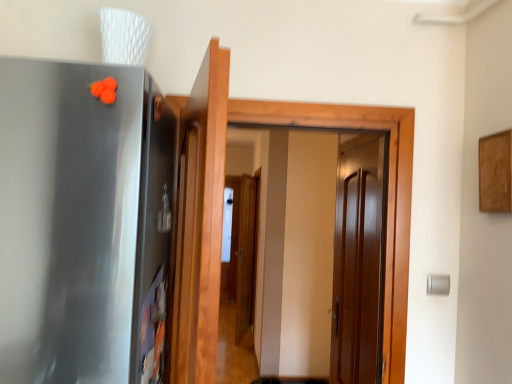
Describe the element at coordinates (357, 261) in the screenshot. The width and height of the screenshot is (512, 384). I see `glossy wood door at center, the first door when ordered from right to left` at that location.

Image resolution: width=512 pixels, height=384 pixels. Find the location of `wooden door at center, the first door from the front`. wooden door at center, the first door from the front is located at coordinates (200, 221).

What do you see at coordinates (83, 222) in the screenshot? I see `satin metallic refrigerator at left` at bounding box center [83, 222].

Image resolution: width=512 pixels, height=384 pixels. I want to click on glossy wood door at center, the first door when ordered from right to left, so click(357, 261).

Is wooden door at center, which ranks as the 2th door in back-to-front order, smaller than satin metallic refrigerator at left?

Yes, wooden door at center, which ranks as the 2th door in back-to-front order, is smaller than satin metallic refrigerator at left.

Identify the location of appliance above the wooden door at center, positioned as the 1th door in left-to-right order (from a real-world perspective). (83, 222).

Is wooden door at center, acting as the 2th door starting from the right, positioned beyond the bounds of satin metallic refrigerator at left?

Yes, wooden door at center, acting as the 2th door starting from the right, is outside of satin metallic refrigerator at left.

From a real-world perspective, is wooden door at center, acting as the 2th door starting from the right, physically located above or below satin metallic refrigerator at left?

Clearly, from a real-world perspective, wooden door at center, acting as the 2th door starting from the right, is below satin metallic refrigerator at left.

Are satin metallic refrigerator at left and wooden door at center, the first door from the front, beside each other?

satin metallic refrigerator at left is not next to wooden door at center, the first door from the front, and they're not touching.

From the picture: Between satin metallic refrigerator at left and wooden door at center, the first door from the front, which one has larger size?

satin metallic refrigerator at left.

There is a satin metallic refrigerator at left. Where is `the 1st door below it (from the image's perspective)`? Image resolution: width=512 pixels, height=384 pixels. the 1st door below it (from the image's perspective) is located at coordinates (200, 221).

Is satin metallic refrigerator at left a part of glossy wood door at center, the first door when ordered from right to left?

Actually, satin metallic refrigerator at left is outside glossy wood door at center, the first door when ordered from right to left.

Between glossy wood door at center, arranged as the first door when viewed from the back, and satin metallic refrigerator at left, which one has larger width?

Wider between the two is satin metallic refrigerator at left.

In terms of size, does glossy wood door at center, arranged as the first door when viewed from the back, appear bigger or smaller than satin metallic refrigerator at left?

glossy wood door at center, arranged as the first door when viewed from the back, is smaller than satin metallic refrigerator at left.

How different are the orientations of glossy wood door at center, arranged as the second door when viewed from the left, and satin metallic refrigerator at left in degrees?

86.9 degrees.

From a real-world perspective, is wooden door at center, the first door from the front, positioned over glossy wood door at center, the 2th door from the front, based on gravity?

Correct, in the physical world, wooden door at center, the first door from the front, is higher than glossy wood door at center, the 2th door from the front.

From the image's perspective, is wooden door at center, acting as the 2th door starting from the right, above or below glossy wood door at center, the 2th door from the front?

Clearly, from the image's perspective, wooden door at center, acting as the 2th door starting from the right, is above glossy wood door at center, the 2th door from the front.

Is wooden door at center, positioned as the 1th door in left-to-right order, oriented towards glossy wood door at center, arranged as the first door when viewed from the back?

No, wooden door at center, positioned as the 1th door in left-to-right order, is not oriented towards glossy wood door at center, arranged as the first door when viewed from the back.

Is wooden door at center, which ranks as the 2th door in back-to-front order, next to glossy wood door at center, arranged as the first door when viewed from the back?

No, wooden door at center, which ranks as the 2th door in back-to-front order, is not in contact with glossy wood door at center, arranged as the first door when viewed from the back.

From a real-world perspective, is satin metallic refrigerator at left physically below glossy wood door at center, arranged as the second door when viewed from the left?

No.

Based on the photo, is satin metallic refrigerator at left smaller than glossy wood door at center, the 2th door from the front?

Actually, satin metallic refrigerator at left might be larger than glossy wood door at center, the 2th door from the front.

Between satin metallic refrigerator at left and glossy wood door at center, the first door when ordered from right to left, which one is positioned behind?

glossy wood door at center, the first door when ordered from right to left, is behind.

Is point (36, 92) closer or farther from the camera than point (364, 219)?

Point (36, 92) is positioned closer to the camera compared to point (364, 219).

From a real-world perspective, which object rests below the other?

In real-world perspective, glossy wood door at center, the first door when ordered from right to left, is lower.

Which of these two, glossy wood door at center, the first door when ordered from right to left, or wooden door at center, which ranks as the 2th door in back-to-front order, is wider?

Wider between the two is wooden door at center, which ranks as the 2th door in back-to-front order.

In the image, there is a glossy wood door at center, arranged as the second door when viewed from the left. Where is `door above it (from the image's perspective)`? Image resolution: width=512 pixels, height=384 pixels. door above it (from the image's perspective) is located at coordinates (200, 221).

How much distance is there between glossy wood door at center, the first door when ordered from right to left, and wooden door at center, positioned as the 1th door in left-to-right order?

glossy wood door at center, the first door when ordered from right to left, and wooden door at center, positioned as the 1th door in left-to-right order, are 3.79 feet apart from each other.

You are a GUI agent. You are given a task and a screenshot of the screen. Output one action in this format:
    pyautogui.click(x=<x>, y=<y>)
    Task: Click on the appliance above the wooden door at center, positioned as the 1th door in left-to-right order (from a real-world perspective)
    
    Given the screenshot: What is the action you would take?
    pyautogui.click(x=83, y=222)

The height and width of the screenshot is (384, 512). Identify the location of the 1st door below when counting from the satin metallic refrigerator at left (from the image's perspective). (200, 221).

Which object lies nearer to the anchor point wooden door at center, positioned as the 1th door in left-to-right order, glossy wood door at center, arranged as the first door when viewed from the back, or satin metallic refrigerator at left?

Based on the image, satin metallic refrigerator at left appears to be nearer to wooden door at center, positioned as the 1th door in left-to-right order.

When comparing their distances from wooden door at center, acting as the 2th door starting from the right, does satin metallic refrigerator at left or glossy wood door at center, the 2th door from the front, seem further?

Among the two, glossy wood door at center, the 2th door from the front, is located further to wooden door at center, acting as the 2th door starting from the right.

Estimate the real-world distances between objects in this image. Which object is closer to glossy wood door at center, the 2th door from the front, satin metallic refrigerator at left or wooden door at center, acting as the 2th door starting from the right?

wooden door at center, acting as the 2th door starting from the right, is positioned closer to the anchor glossy wood door at center, the 2th door from the front.

In the scene shown: Which object lies further to the anchor point satin metallic refrigerator at left, wooden door at center, positioned as the 1th door in left-to-right order, or glossy wood door at center, the 2th door from the front?

glossy wood door at center, the 2th door from the front.

Which object lies nearer to the anchor point satin metallic refrigerator at left, glossy wood door at center, the first door when ordered from right to left, or wooden door at center, the first door from the front?

wooden door at center, the first door from the front.

Based on their spatial positions, is wooden door at center, which ranks as the 2th door in back-to-front order, or satin metallic refrigerator at left closer to glossy wood door at center, arranged as the first door when viewed from the back?

wooden door at center, which ranks as the 2th door in back-to-front order, lies closer to glossy wood door at center, arranged as the first door when viewed from the back, than the other object.

Identify the location of appliance between wooden door at center, which ranks as the 2th door in back-to-front order, and glossy wood door at center, the 2th door from the front, along the z-axis. (83, 222).